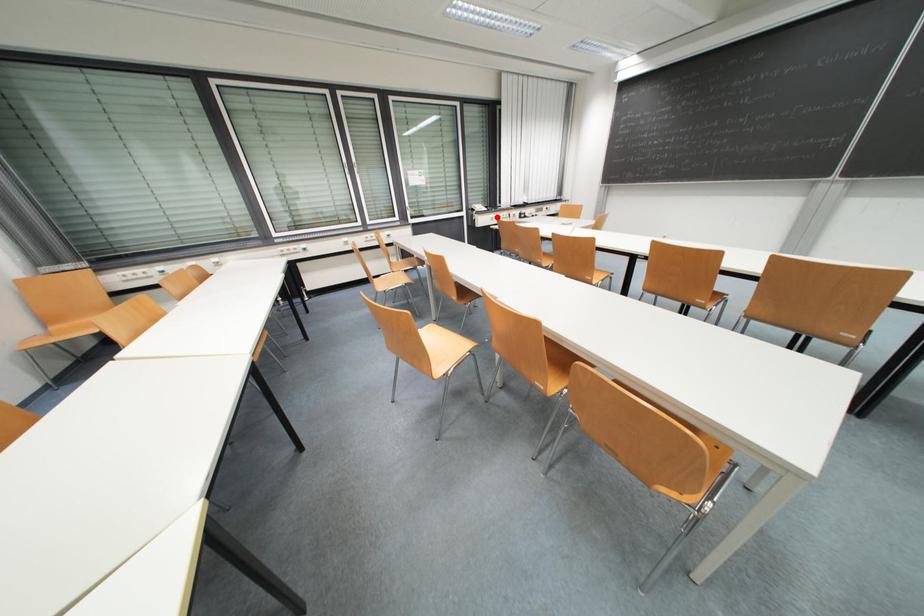
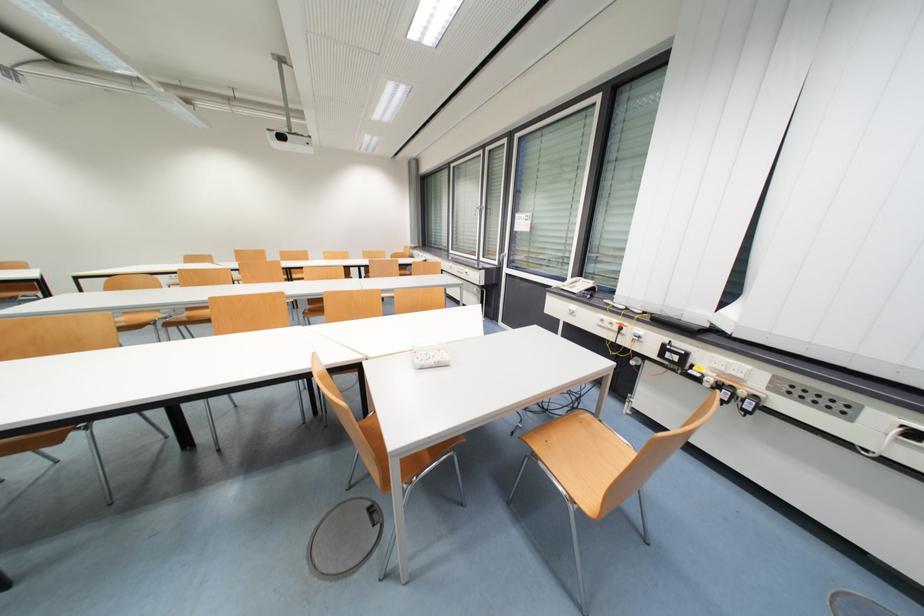
Where in the second image is the point corresponding to the highlighted location from the first image?

(578, 309)